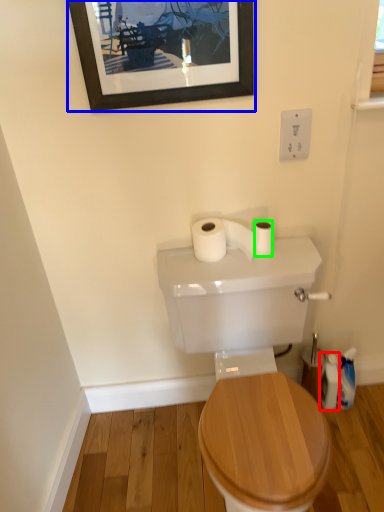
Question: Which object is positioned farthest from toiletry (highlighted by a red box)? Select from picture frame (highlighted by a blue box) and toilet paper (highlighted by a green box).

Choices:
 (A) picture frame
 (B) toilet paper

Answer: (A)